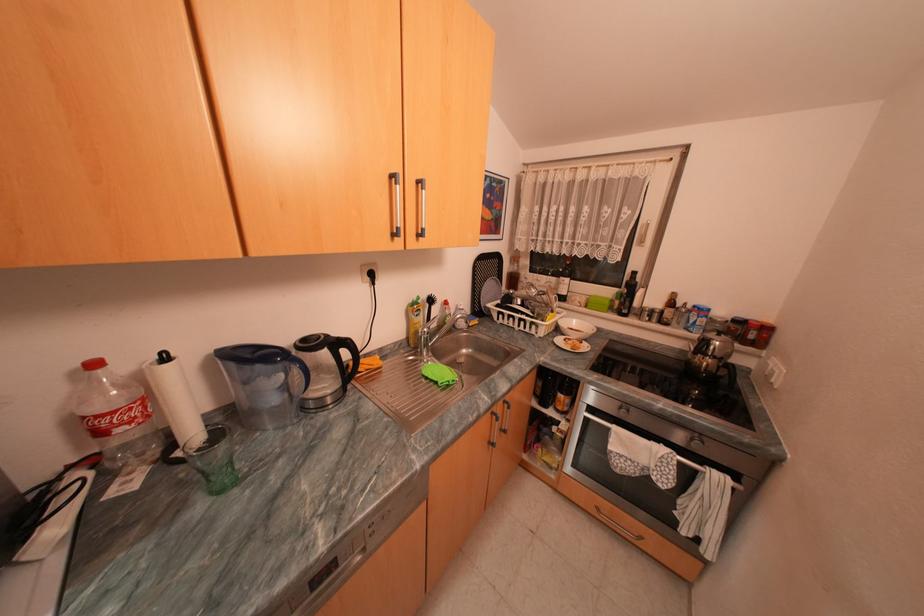
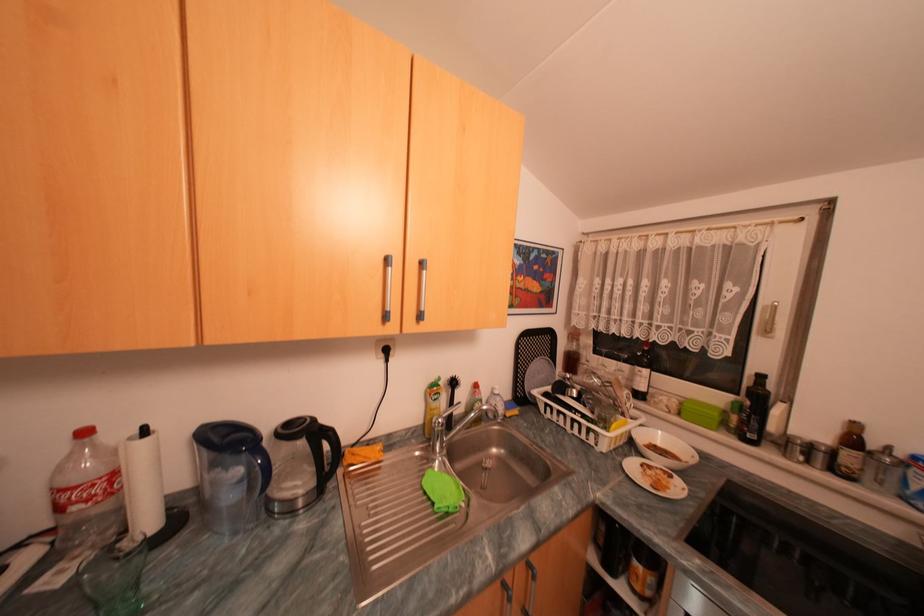
The point at (553, 296) is marked in the first image. Where is the corresponding point in the second image?

(622, 389)